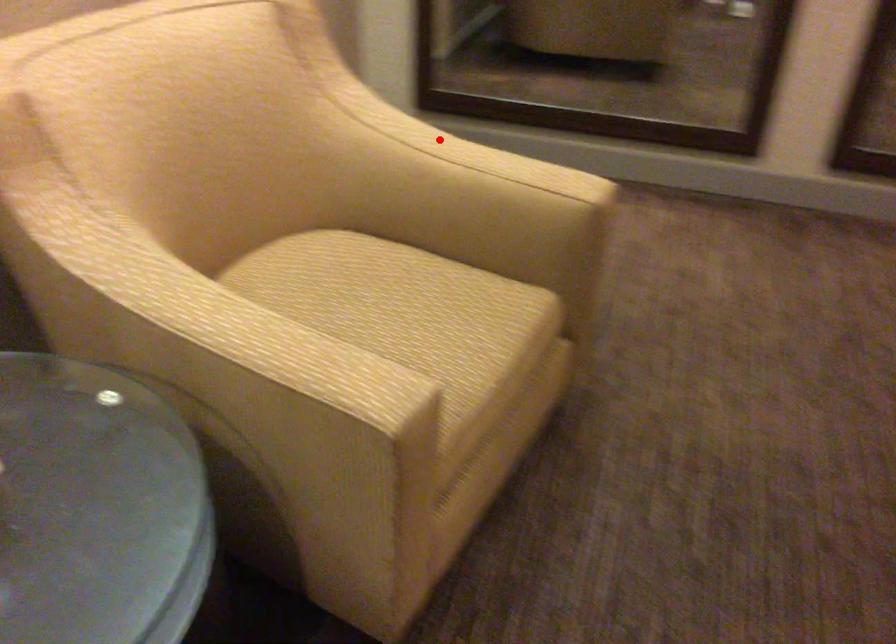
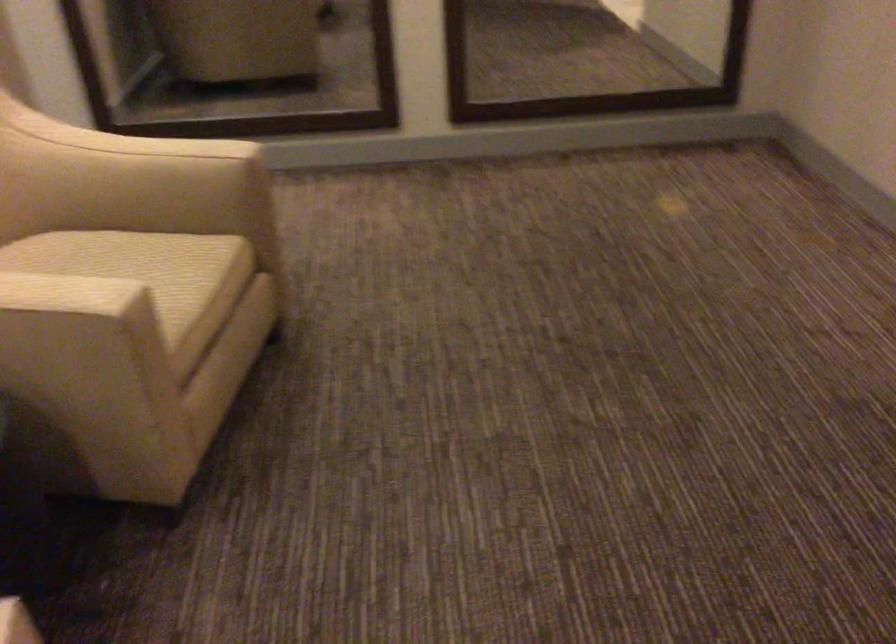
Question: I am providing you with two images of the same scene from different viewpoints. A red point is shown in image1. For the corresponding object point in image2, is it positioned nearer or farther from the camera?

Choices:
 (A) Nearer
 (B) Farther

Answer: (B)